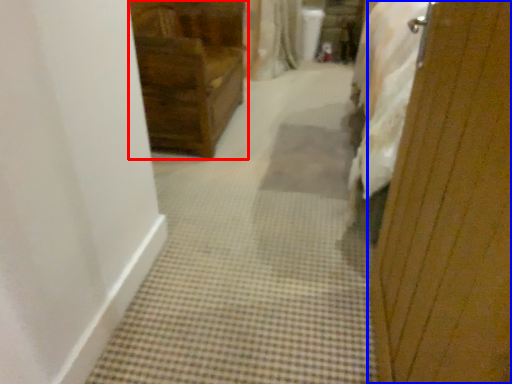
Question: Which object is closer to the camera taking this photo, furniture (highlighted by a red box) or screen door (highlighted by a blue box)?

Choices:
 (A) furniture
 (B) screen door

Answer: (B)